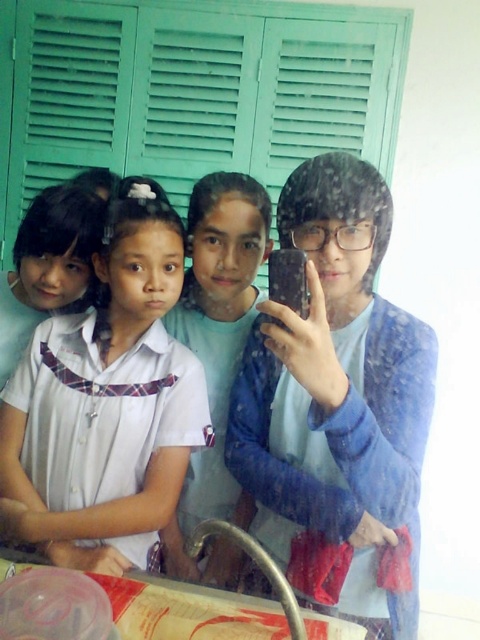
You are trying to decide which blue shirt to wear for a casual day out. Both the blue fabric shirt at center and the matte blue shirt at center are options. Based on the image description, which one is larger?

The blue fabric shirt at center is bigger than the matte blue shirt at center, so you should choose the blue fabric shirt at center if you prefer a larger size.

You are a photographer trying to capture a group photo of the blue fabric shirt at center and the white fabric shirt at center. Which shirt should you focus on if you want to ensure the larger one is in sharp focus?

The blue fabric shirt at center is bigger than the white fabric shirt at center, so you should focus on the blue fabric shirt at center to ensure the larger one is in sharp focus.